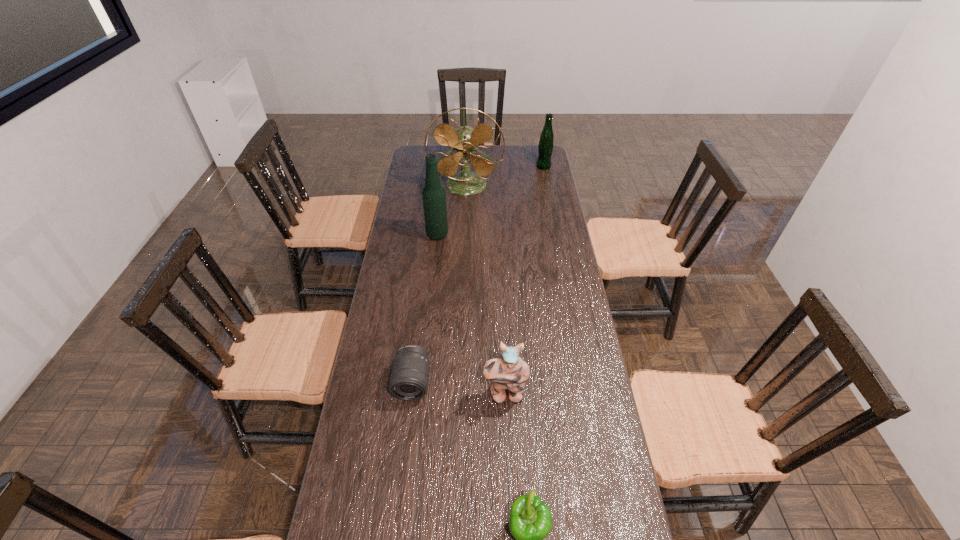
The width and height of the screenshot is (960, 540). What are the coordinates of `vacant space located 0.200m on the surface of the shortest object` in the screenshot? It's located at (x=401, y=470).

Where is `object at the far edge`? The height and width of the screenshot is (540, 960). object at the far edge is located at coordinates (546, 143).

Image resolution: width=960 pixels, height=540 pixels. I want to click on fan located in the left edge section of the desktop, so click(464, 140).

What are the coordinates of `alcohol present at the left edge` in the screenshot? It's located at (434, 196).

The height and width of the screenshot is (540, 960). I want to click on telephoto lens located in the left edge section of the desktop, so click(409, 377).

Find the location of a particular element. This screenshot has height=540, width=960. object that is positioned at the right edge is located at coordinates click(x=546, y=143).

The width and height of the screenshot is (960, 540). Identify the location of object that is at the far right corner. (546, 143).

Identify the location of vacant point at the left edge. (387, 372).

Image resolution: width=960 pixels, height=540 pixels. I want to click on vacant space at the right edge of the desktop, so click(536, 193).

Locate an element on the screen. Image resolution: width=960 pixels, height=540 pixels. free point at the far left corner is located at coordinates (433, 150).